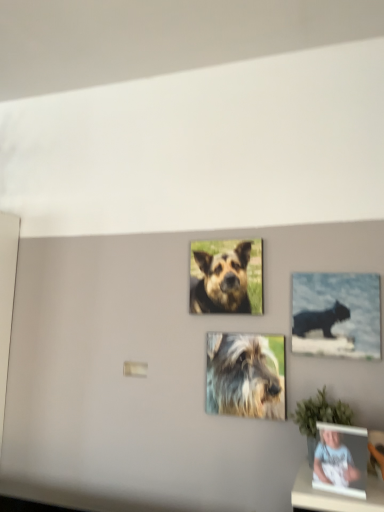
The image size is (384, 512). I want to click on brown fur dog at center, which is the second dog from bottom to top, so click(x=222, y=281).

What is the approximate width of black glossy cat at upper right?

It is 1.46 inches.

Find the location of a particular element. The image size is (384, 512). brown fur dog at center, which is the second dog from bottom to top is located at coordinates (222, 281).

Which is in front, black glossy cat at upper right or fuzzy fur dog at center, the 1th dog when ordered from bottom to top?

black glossy cat at upper right is closer to the camera.

Does black glossy cat at upper right turn towards fuzzy fur dog at center, the second dog positioned from the top?

No.

Can fuzzy fur dog at center, the second dog positioned from the top, be found inside black glossy cat at upper right?

No.

Does point (353, 476) come in front of point (228, 407)?

Yes, it is.

From the image's perspective, is matte black photo frame at lower right on fuzzy fur dog at center, the 1th dog when ordered from bottom to top?

No, from the image's perspective, matte black photo frame at lower right is not above fuzzy fur dog at center, the 1th dog when ordered from bottom to top.

Can we say matte black photo frame at lower right lies outside fuzzy fur dog at center, the 1th dog when ordered from bottom to top?

matte black photo frame at lower right lies outside fuzzy fur dog at center, the 1th dog when ordered from bottom to top,'s area.

Between matte black photo frame at lower right and fuzzy fur dog at center, the second dog positioned from the top, which one appears on the right side from the viewer's perspective?

matte black photo frame at lower right is more to the right.

Considering the relative positions of fuzzy fur dog at center, the 1th dog when ordered from bottom to top, and brown fur dog at center, which is counted as the 1th dog, starting from the top, in the image provided, is fuzzy fur dog at center, the 1th dog when ordered from bottom to top, to the left or to the right of brown fur dog at center, which is counted as the 1th dog, starting from the top,?

Based on their positions, fuzzy fur dog at center, the 1th dog when ordered from bottom to top, is located to the right of brown fur dog at center, which is counted as the 1th dog, starting from the top.

Can you confirm if fuzzy fur dog at center, the second dog positioned from the top, is taller than brown fur dog at center, which is the second dog from bottom to top?

In fact, fuzzy fur dog at center, the second dog positioned from the top, may be shorter than brown fur dog at center, which is the second dog from bottom to top.

Is fuzzy fur dog at center, the second dog positioned from the top, looking in the opposite direction of brown fur dog at center, which is counted as the 1th dog, starting from the top?

No, fuzzy fur dog at center, the second dog positioned from the top, is not facing away from brown fur dog at center, which is counted as the 1th dog, starting from the top.

Can we say fuzzy fur dog at center, the 1th dog when ordered from bottom to top, lies outside brown fur dog at center, which is the second dog from bottom to top?

fuzzy fur dog at center, the 1th dog when ordered from bottom to top, lies outside brown fur dog at center, which is the second dog from bottom to top,'s area.

Is matte black photo frame at lower right oriented towards black glossy cat at upper right?

No, matte black photo frame at lower right is not aimed at black glossy cat at upper right.

What's the angular difference between matte black photo frame at lower right and black glossy cat at upper right's facing directions?

They differ by 10.3 degrees in their facing directions.

From a real-world perspective, which is physically above, matte black photo frame at lower right or black glossy cat at upper right?

black glossy cat at upper right is physically above.

Considering the sizes of matte black photo frame at lower right and black glossy cat at upper right in the image, is matte black photo frame at lower right taller or shorter than black glossy cat at upper right?

matte black photo frame at lower right is shorter than black glossy cat at upper right.

Does black glossy cat at upper right appear on the right side of matte black photo frame at lower right?

Yes, black glossy cat at upper right is to the right of matte black photo frame at lower right.

Can we say black glossy cat at upper right lies outside matte black photo frame at lower right?

Yes, black glossy cat at upper right is located beyond the bounds of matte black photo frame at lower right.

Does point (333, 304) come in front of point (326, 483)?

No, (333, 304) is further to viewer.

Which object is thinner, black glossy cat at upper right or matte black photo frame at lower right?

Thinner between the two is black glossy cat at upper right.

Considering the points (338, 273) and (233, 274), which point is in front, point (338, 273) or point (233, 274)?

The point (338, 273) is in front.

Could brown fur dog at center, which is the second dog from bottom to top, be considered to be inside black glossy cat at upper right?

No, brown fur dog at center, which is the second dog from bottom to top, is not a part of black glossy cat at upper right.

Considering the sizes of objects black glossy cat at upper right and brown fur dog at center, which is counted as the 1th dog, starting from the top, in the image provided, who is thinner, black glossy cat at upper right or brown fur dog at center, which is counted as the 1th dog, starting from the top,?

With smaller width is brown fur dog at center, which is counted as the 1th dog, starting from the top.

From the image's perspective, is black glossy cat at upper right positioned above or below brown fur dog at center, which is counted as the 1th dog, starting from the top?

black glossy cat at upper right is below brown fur dog at center, which is counted as the 1th dog, starting from the top.

Looking at this image, is matte black photo frame at lower right bigger than brown fur dog at center, which is counted as the 1th dog, starting from the top?

No.

From the picture: Is matte black photo frame at lower right completely or partially outside of brown fur dog at center, which is the second dog from bottom to top?

matte black photo frame at lower right is positioned outside brown fur dog at center, which is the second dog from bottom to top.

Are matte black photo frame at lower right and brown fur dog at center, which is counted as the 1th dog, starting from the top, far apart?

No, matte black photo frame at lower right is not far away from brown fur dog at center, which is counted as the 1th dog, starting from the top.

Which is closer to the camera, (336, 460) or (233, 302)?

Positioned in front is point (336, 460).

I want to click on dog below the black glossy cat at upper right (from the image's perspective), so click(x=246, y=375).

Locate an element on the screen. This screenshot has height=512, width=384. the 1st dog directly above the matte black photo frame at lower right (from a real-world perspective) is located at coordinates (246, 375).

Considering their positions, is fuzzy fur dog at center, the 1th dog when ordered from bottom to top, positioned closer to brown fur dog at center, which is the second dog from bottom to top, than matte black photo frame at lower right?

fuzzy fur dog at center, the 1th dog when ordered from bottom to top.

From the image, which object appears to be nearer to matte black photo frame at lower right, fuzzy fur dog at center, the 1th dog when ordered from bottom to top, or black glossy cat at upper right?

fuzzy fur dog at center, the 1th dog when ordered from bottom to top, is closer to matte black photo frame at lower right.

Looking at the image, which one is located closer to matte black photo frame at lower right, brown fur dog at center, which is counted as the 1th dog, starting from the top, or black glossy cat at upper right?

black glossy cat at upper right is positioned closer to the anchor matte black photo frame at lower right.

Considering their positions, is brown fur dog at center, which is the second dog from bottom to top, positioned further to fuzzy fur dog at center, the 1th dog when ordered from bottom to top, than black glossy cat at upper right?

brown fur dog at center, which is the second dog from bottom to top.

Looking at this image, looking at the image, which one is located closer to matte black photo frame at lower right, brown fur dog at center, which is counted as the 1th dog, starting from the top, or fuzzy fur dog at center, the 1th dog when ordered from bottom to top?

fuzzy fur dog at center, the 1th dog when ordered from bottom to top, lies closer to matte black photo frame at lower right than the other object.

Looking at the image, which one is located closer to matte black photo frame at lower right, black glossy cat at upper right or brown fur dog at center, which is the second dog from bottom to top?

The object closer to matte black photo frame at lower right is black glossy cat at upper right.

Based on their spatial positions, is black glossy cat at upper right or fuzzy fur dog at center, the second dog positioned from the top, further from brown fur dog at center, which is counted as the 1th dog, starting from the top?

black glossy cat at upper right is positioned further to the anchor brown fur dog at center, which is counted as the 1th dog, starting from the top.

When comparing their distances from matte black photo frame at lower right, does black glossy cat at upper right or fuzzy fur dog at center, the 1th dog when ordered from bottom to top, seem further?

black glossy cat at upper right lies further to matte black photo frame at lower right than the other object.

The height and width of the screenshot is (512, 384). Find the location of `picture frame between matte black photo frame at lower right and fuzzy fur dog at center, the 1th dog when ordered from bottom to top, along the z-axis`. picture frame between matte black photo frame at lower right and fuzzy fur dog at center, the 1th dog when ordered from bottom to top, along the z-axis is located at coordinates (337, 315).

You are a GUI agent. You are given a task and a screenshot of the screen. Output one action in this format:
    pyautogui.click(x=<x>, y=<y>)
    Task: Click on the dog between brown fur dog at center, which is counted as the 1th dog, starting from the top, and matte black photo frame at lower right in the up-down direction
    
    Given the screenshot: What is the action you would take?
    pyautogui.click(x=246, y=375)

Where is `picture frame between brown fur dog at center, which is the second dog from bottom to top, and matte black photo frame at lower right in the up-down direction`? picture frame between brown fur dog at center, which is the second dog from bottom to top, and matte black photo frame at lower right in the up-down direction is located at coordinates (337, 315).

Find the location of a particular element. dog located between brown fur dog at center, which is the second dog from bottom to top, and black glossy cat at upper right in the left-right direction is located at coordinates (246, 375).